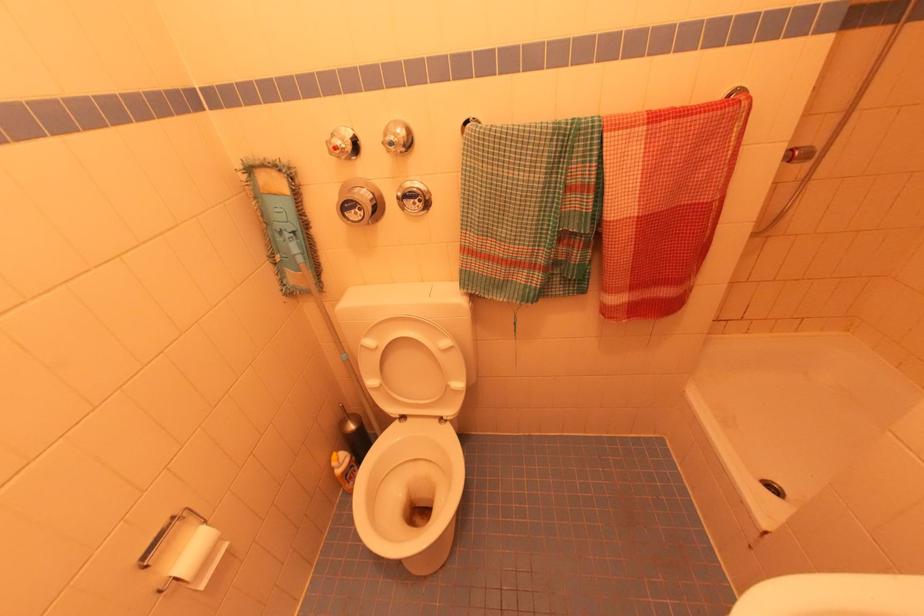
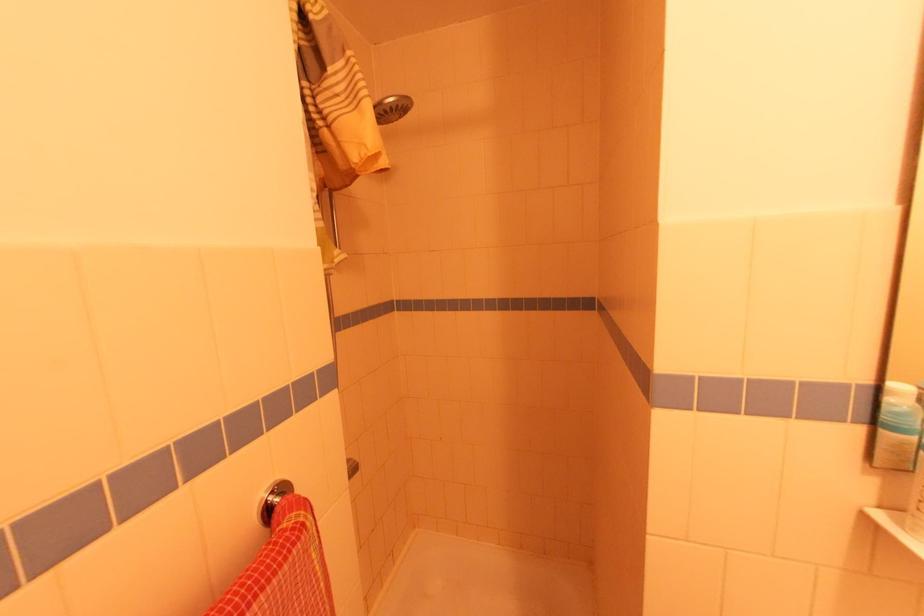
Question: Based on the continuous images, in which direction is the camera rotating? Reply with the corresponding letter.

Choices:
 (A) Left
 (B) Right
 (C) Up
 (D) Down

Answer: (B)